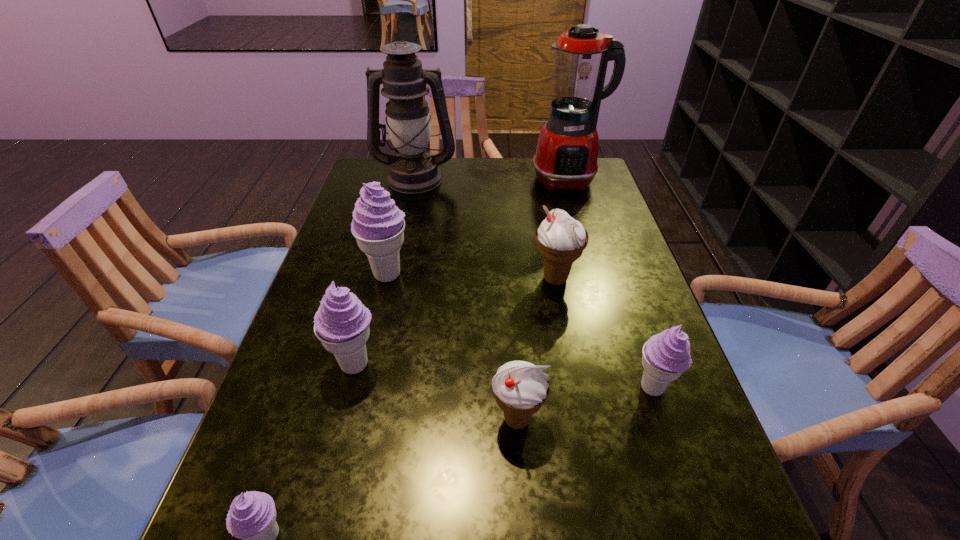
This screenshot has width=960, height=540. Find the location of `oil lamp at the left edge`. oil lamp at the left edge is located at coordinates (413, 170).

Identify the location of food processor located at the right edge. This screenshot has height=540, width=960. (566, 156).

Find the location of `object that is positioned at the far left corner`. object that is positioned at the far left corner is located at coordinates (413, 170).

Where is `object situated at the far right corner`? The height and width of the screenshot is (540, 960). object situated at the far right corner is located at coordinates (566, 156).

In the image, there is a desktop. What are the coordinates of `blank space at the far edge` in the screenshot? It's located at (494, 174).

This screenshot has height=540, width=960. Identify the location of free space at the left edge of the desktop. (313, 447).

This screenshot has width=960, height=540. In order to click on free region at the right edge of the desktop in this screenshot , I will do `click(613, 353)`.

The image size is (960, 540). What are the coordinates of `free space at the far right corner of the desktop` in the screenshot? It's located at (586, 187).

Locate an element on the screen. This screenshot has height=540, width=960. vacant area that lies between the tallest icecream and the rightmost purple icecream is located at coordinates (519, 331).

The height and width of the screenshot is (540, 960). What are the coordinates of `free space between the oil lamp and the second icecream from right to left` in the screenshot? It's located at (486, 228).